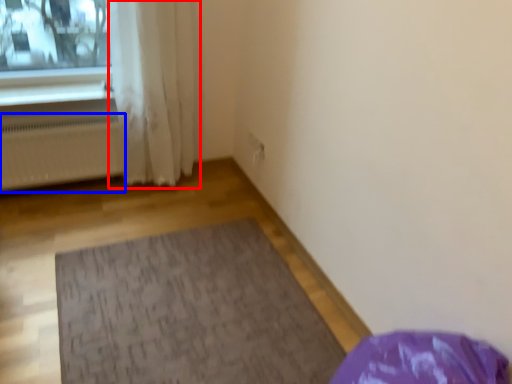
Question: Which object is closer to the camera taking this photo, curtain (highlighted by a red box) or radiator (highlighted by a blue box)?

Choices:
 (A) curtain
 (B) radiator

Answer: (A)